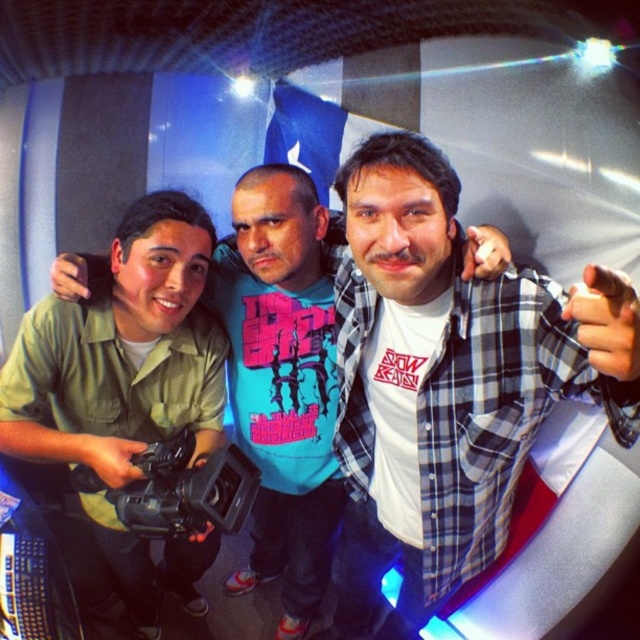
Question: Which point appears closest to the camera in this image?

Choices:
 (A) (627, 362)
 (B) (232, 492)

Answer: (A)

Question: Which of the following is the closest to the observer?

Choices:
 (A) (243, 573)
 (B) (506, 442)
 (C) (216, 480)

Answer: (C)

Question: Does plaid shirt at center appear on the right side of green matte shirt at left?

Choices:
 (A) no
 (B) yes

Answer: (B)

Question: In this image, where is green matte shirt at left located relative to black plastic camera at center?

Choices:
 (A) left
 (B) right

Answer: (B)

Question: Does plaid shirt at center appear on the left side of black plastic camera at center?

Choices:
 (A) no
 (B) yes

Answer: (A)

Question: Based on their relative distances, which object is farther from the plaid shirt at center?

Choices:
 (A) green matte shirt at left
 (B) black plastic camera at center

Answer: (A)